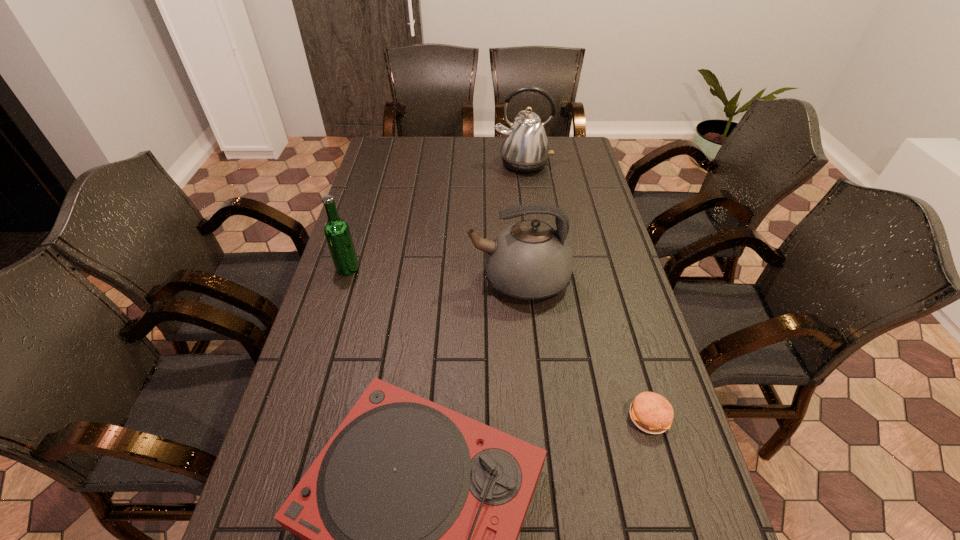
I want to click on the farther kettle, so click(525, 149).

Identify the location of the nearer kettle. (529, 260).

Where is `beer bottle`? This screenshot has width=960, height=540. beer bottle is located at coordinates (337, 232).

You are a GUI agent. You are given a task and a screenshot of the screen. Output one action in this format:
    pyautogui.click(x=<x>, y=<y>)
    Task: Click on the rightmost object
    
    Given the screenshot: What is the action you would take?
    pyautogui.click(x=652, y=413)

The image size is (960, 540). In order to click on hamburger in this screenshot , I will do `click(652, 413)`.

The image size is (960, 540). Find the location of `free space located from the spout of the farther kettle`. free space located from the spout of the farther kettle is located at coordinates (528, 205).

This screenshot has width=960, height=540. I want to click on vacant area situated at the spout of the nearer kettle, so click(345, 280).

Identify the location of vacant space situated 0.350m at the spout of the nearer kettle. Image resolution: width=960 pixels, height=540 pixels. (351, 280).

The height and width of the screenshot is (540, 960). What are the coordinates of `free spot located 0.370m at the spout of the nearer kettle` in the screenshot? It's located at (345, 280).

The height and width of the screenshot is (540, 960). What are the coordinates of `free space located on the right of the leftmost object` in the screenshot? It's located at (414, 268).